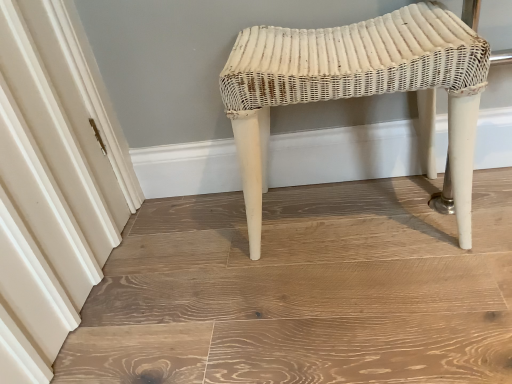
The image size is (512, 384). In order to click on vacant location below white wicker stool at center (from a real-world perspective) in this screenshot , I will do pos(350,215).